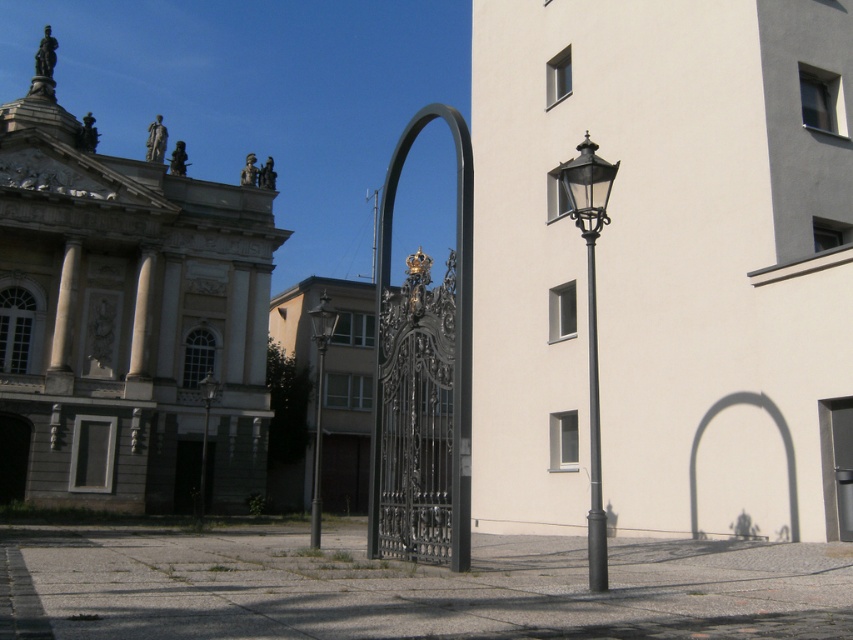
You are a pedestrian standing in front of the classical building on the left. You notice a matte black street light at right and a black metal pole at center. Which object is closer to your right side?

The matte black street light at right is closer to your right side because it is positioned to the right of the black metal pole at center.

From the picture: You are standing in the urban scene and want to determine the relative positions of two points. Which point, point (315,310) or point (206,397), is closer to you?

Point (315,310) is closer to the viewer than point (206,397).

You are standing in the urban scene and want to walk from the classical building to the modern building. There are two points marked on the path. Which point, point (589, 540) or point (97, 490), is closer to your starting position at the classical building?

Point (589, 540) is closer to the classical building because it is in front of point (97, 490), meaning it lies between the classical building and the other point along the path.